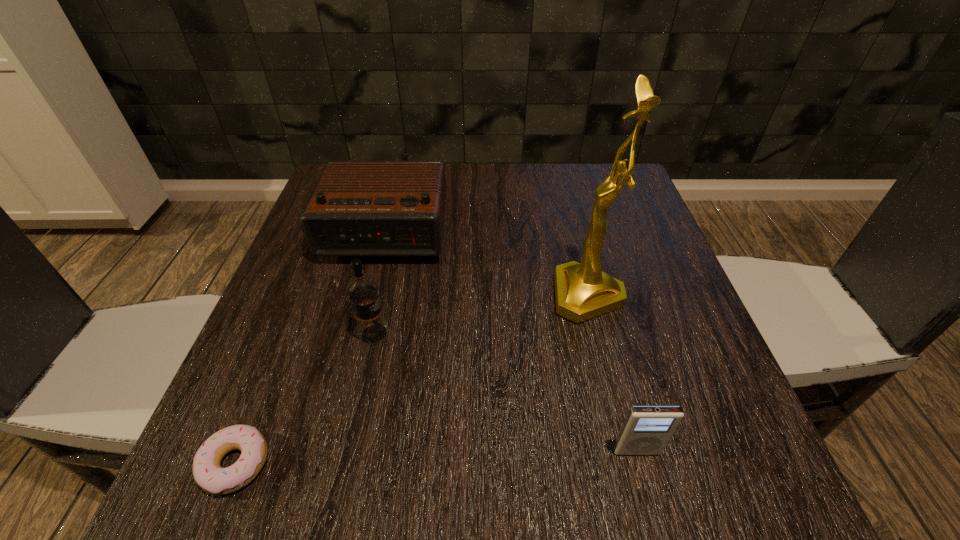
The width and height of the screenshot is (960, 540). I want to click on free space located on the front panel of the third tallest object, so click(x=340, y=400).

Locate an element on the screen. free space located on the front-facing side of the iPod is located at coordinates (652, 509).

The image size is (960, 540). I want to click on free space located on the back of the shortest object, so click(271, 375).

In order to click on object located in the far edge section of the desktop in this screenshot , I will do `click(359, 208)`.

Image resolution: width=960 pixels, height=540 pixels. Find the location of `iPod at the near edge`. iPod at the near edge is located at coordinates (646, 430).

Where is `doughnut that is at the near edge`? The height and width of the screenshot is (540, 960). doughnut that is at the near edge is located at coordinates (209, 475).

What are the coordinates of `radio receiver situated at the left edge` in the screenshot? It's located at click(359, 208).

Find the location of a particular element. doughnut that is at the left edge is located at coordinates (x=209, y=475).

At what (x,y) coordinates should I click in order to perform the action: click on award located at the right edge. Please return your answer as a coordinate pair (x, y). The image size is (960, 540). Looking at the image, I should click on (583, 291).

In order to click on iPod at the right edge in this screenshot , I will do `click(646, 430)`.